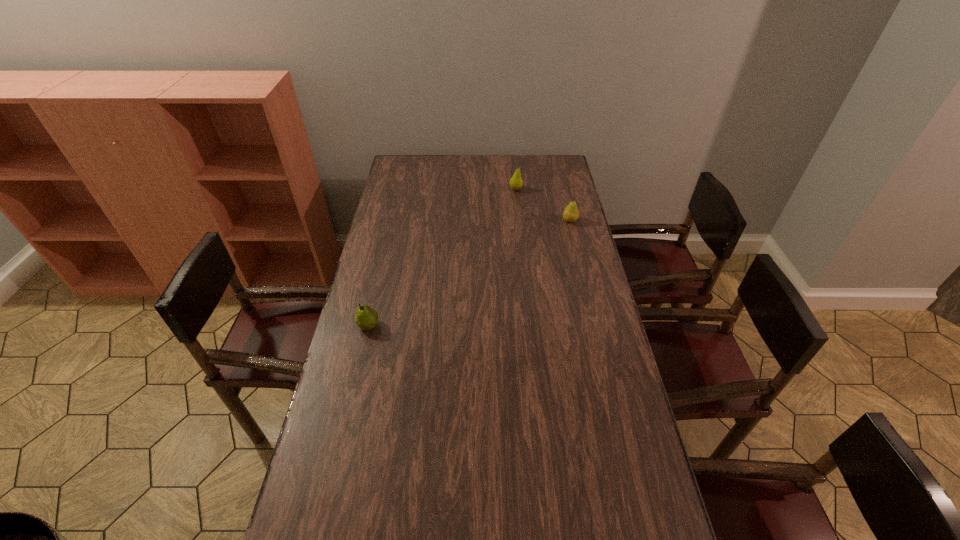
Where is `object that is at the right edge`? Image resolution: width=960 pixels, height=540 pixels. object that is at the right edge is located at coordinates (571, 213).

This screenshot has width=960, height=540. In the image, there is a desktop. Find the location of `vacant space at the far edge`. vacant space at the far edge is located at coordinates (519, 155).

In the image, there is a desktop. At what (x,y) coordinates should I click in order to perform the action: click on vacant space at the left edge. Please return your answer as a coordinate pair (x, y). The height and width of the screenshot is (540, 960). Looking at the image, I should click on (379, 237).

Where is `blank area at the right edge`? Image resolution: width=960 pixels, height=540 pixels. blank area at the right edge is located at coordinates (569, 294).

This screenshot has width=960, height=540. Find the location of `free space at the far left corner of the desktop`. free space at the far left corner of the desktop is located at coordinates pos(405,163).

In the image, there is a desktop. At what (x,y) coordinates should I click in order to perform the action: click on vacant space at the far right corner. Please return your answer as a coordinate pair (x, y). The width and height of the screenshot is (960, 540). Looking at the image, I should click on click(556, 157).

You are a GUI agent. You are given a task and a screenshot of the screen. Output one action in this format:
    pyautogui.click(x=<x>, y=<y>)
    Task: Click on the empty space between the second pear from right to left and the leftmost pear
    The width and height of the screenshot is (960, 540).
    Given the screenshot: What is the action you would take?
    pyautogui.click(x=443, y=258)

Where is `free space between the second pear from left to right and the second farthest object`? free space between the second pear from left to right and the second farthest object is located at coordinates (542, 205).

You are a GUI agent. You are given a task and a screenshot of the screen. Output one action in this format:
    pyautogui.click(x=<x>, y=<y>)
    Task: Click on the empty space between the rightmost object and the nearest pear
    The width and height of the screenshot is (960, 540).
    Given the screenshot: What is the action you would take?
    (469, 273)

What are the coordinates of `free spot between the second nearest object and the farthest pear` in the screenshot? It's located at (542, 205).